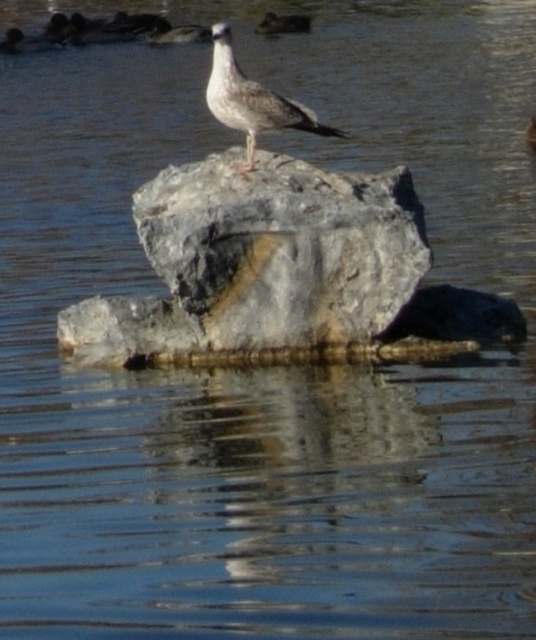
Does gray/rough rock at center appear over gray feathered seagull at center?

Actually, gray/rough rock at center is below gray feathered seagull at center.

Who is more forward, (295,177) or (262,109)?

Point (262,109)

The width and height of the screenshot is (536, 640). Find the location of `gray/rough rock at center`. gray/rough rock at center is located at coordinates coord(282,248).